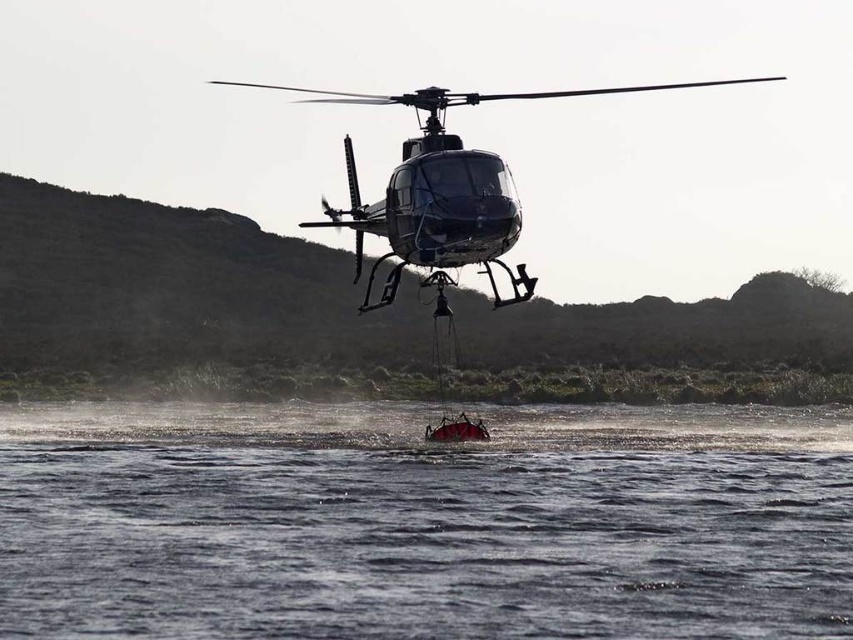
Is point (30, 412) behind point (498, 307)?

Yes, point (30, 412) is farther from viewer.

Is point (486, 442) positioned in front of point (412, 202)?

No, (486, 442) is further to viewer.

Where is `red rubber boat at lower center`? The image size is (853, 640). red rubber boat at lower center is located at coordinates (422, 522).

Can you confirm if metallic dark gray helicopter at center is smaller than red matte boat at center?

Actually, metallic dark gray helicopter at center might be larger than red matte boat at center.

Is point (364, 104) closer to viewer compared to point (473, 435)?

No, (364, 104) is behind (473, 435).

Where is `metallic dark gray helicopter at center`? metallic dark gray helicopter at center is located at coordinates (444, 192).

Is red rubber boat at lower center below red matte boat at center?

Correct, red rubber boat at lower center is located below red matte boat at center.

Can you confirm if red rubber boat at lower center is positioned above red matte boat at center?

Incorrect, red rubber boat at lower center is not positioned above red matte boat at center.

Which is behind, point (660, 506) or point (463, 422)?

The point (463, 422) is behind.

Where is `red rubber boat at lower center`? The height and width of the screenshot is (640, 853). red rubber boat at lower center is located at coordinates (422, 522).